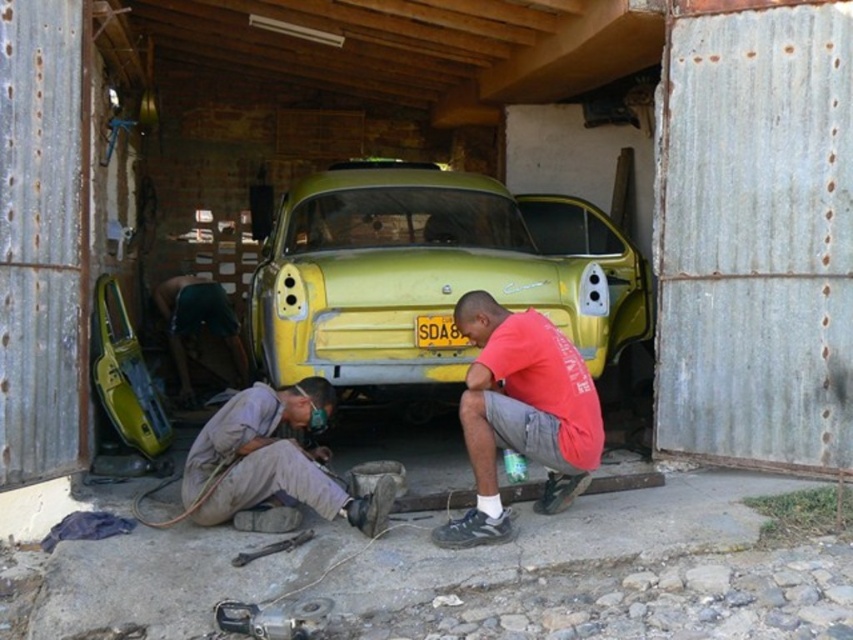
Question: Does brown leather pants at lower left appear over green matte car door at center?

Choices:
 (A) yes
 (B) no

Answer: (B)

Question: Which point appears closest to the camera in this image?

Choices:
 (A) (436, 172)
 (B) (194, 278)

Answer: (A)

Question: Can you confirm if yellow matte car at center is smaller than green matte car door at center?

Choices:
 (A) yes
 (B) no

Answer: (B)

Question: Among these points, which one is farthest from the camera?

Choices:
 (A) (157, 294)
 (B) (242, 497)
 (C) (531, 433)
 (D) (322, 188)

Answer: (A)

Question: Does yellow matte car at center appear under brown leather pants at lower left?

Choices:
 (A) yes
 (B) no

Answer: (B)

Question: Which point is closer to the camera?

Choices:
 (A) red cotton shirt at center
 (B) brown leather pants at lower left
 (C) yellow matte car at center

Answer: (A)